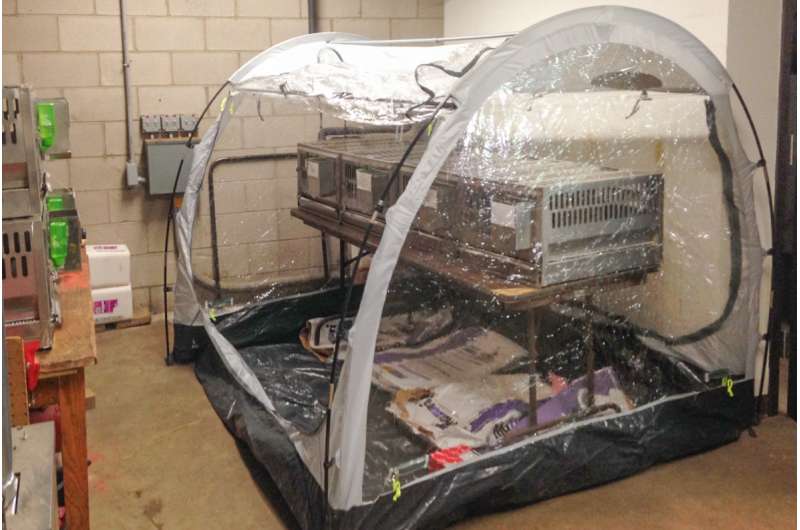
Where is `wall`? The width and height of the screenshot is (800, 530). wall is located at coordinates (170, 29).